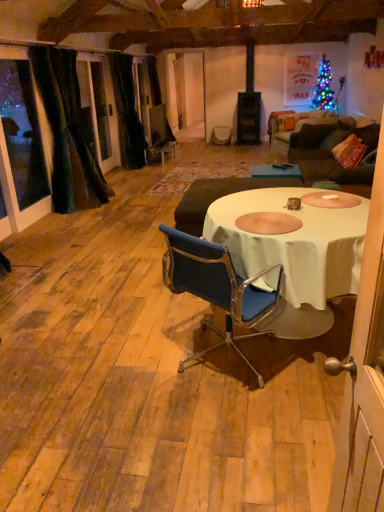
Locate an element on the screen. This screenshot has width=384, height=512. free space that is to the left of white cloth table at center is located at coordinates (92, 348).